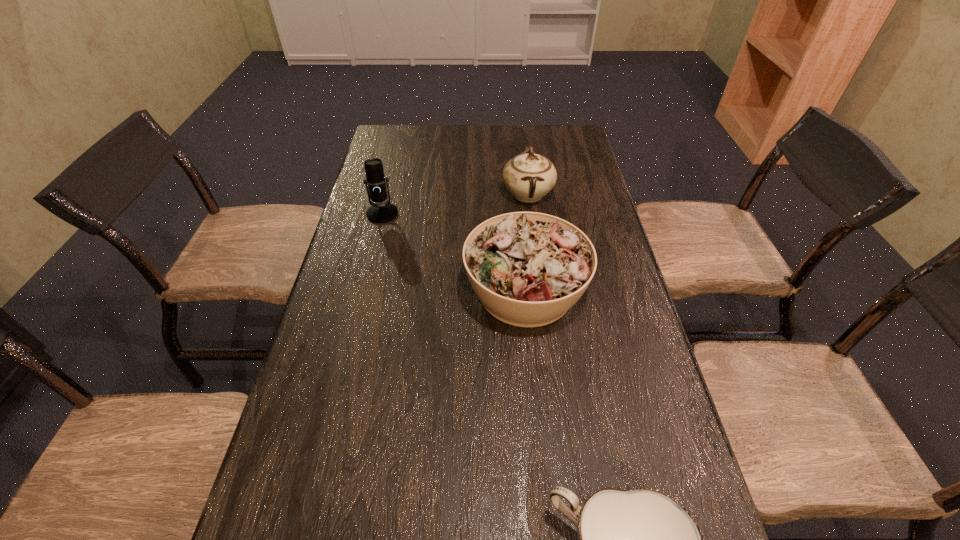
In the image, there is a desktop. Where is `vacant space at the left edge`? vacant space at the left edge is located at coordinates (314, 346).

The image size is (960, 540). What are the coordinates of `blank space at the right edge of the desktop` in the screenshot? It's located at (657, 401).

Where is `vacant space at the far left corner of the desktop`? vacant space at the far left corner of the desktop is located at coordinates (408, 154).

Find the location of `free region at the far right corner`. free region at the far right corner is located at coordinates (575, 148).

You are a GUI agent. You are given a task and a screenshot of the screen. Output one action in this format:
    pyautogui.click(x=<x>, y=<y>)
    Task: Click on the vacant region between the salad and the microphone
    The width and height of the screenshot is (960, 540).
    Given the screenshot: What is the action you would take?
    pyautogui.click(x=454, y=252)

In order to click on blank region between the salad and the microphone in this screenshot , I will do `click(454, 252)`.

Where is `object identified as the second closest to the second nearest object`? object identified as the second closest to the second nearest object is located at coordinates (383, 212).

The width and height of the screenshot is (960, 540). In order to click on object that can be found as the third closest to the third farthest object in this screenshot , I will do `click(641, 539)`.